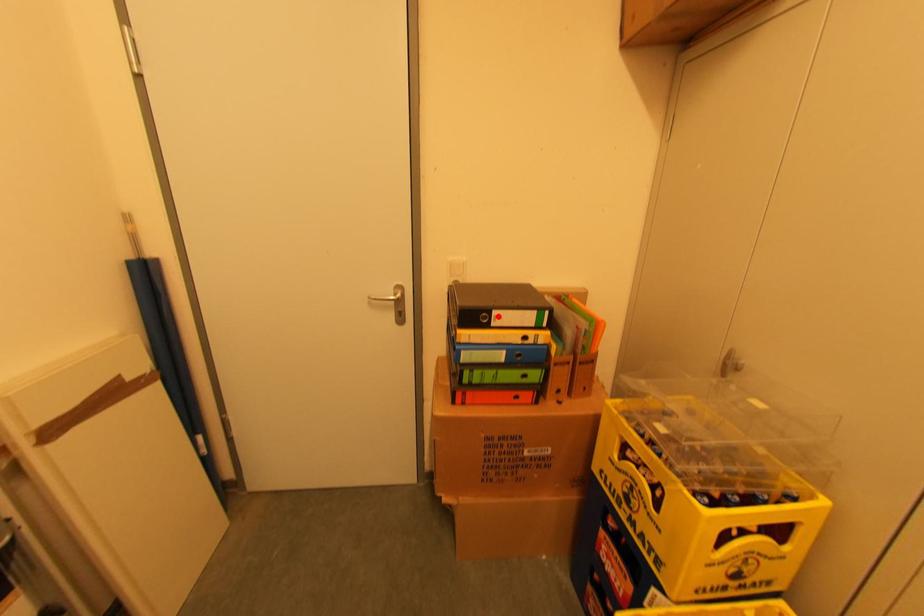
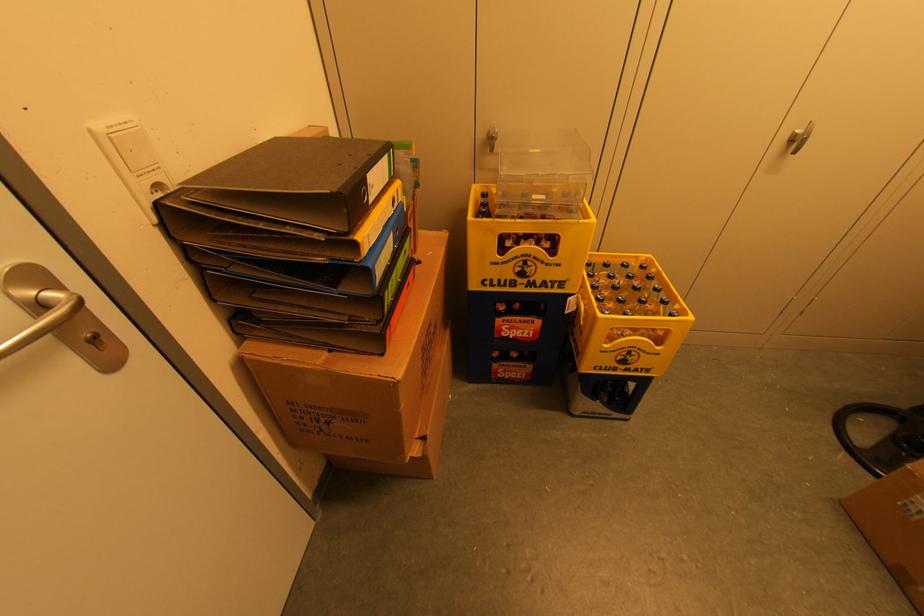
Locate, in the second image, the point that corresponds to the highlighted location in the first image.

(371, 185)